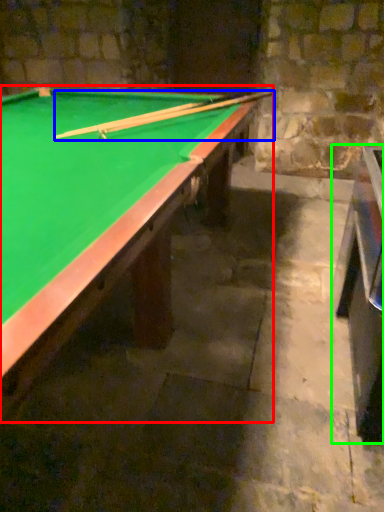
Question: Which is farther away from billiard table (highlighted by a red box)? cue (highlighted by a blue box) or table (highlighted by a green box)?

Choices:
 (A) cue
 (B) table

Answer: (B)